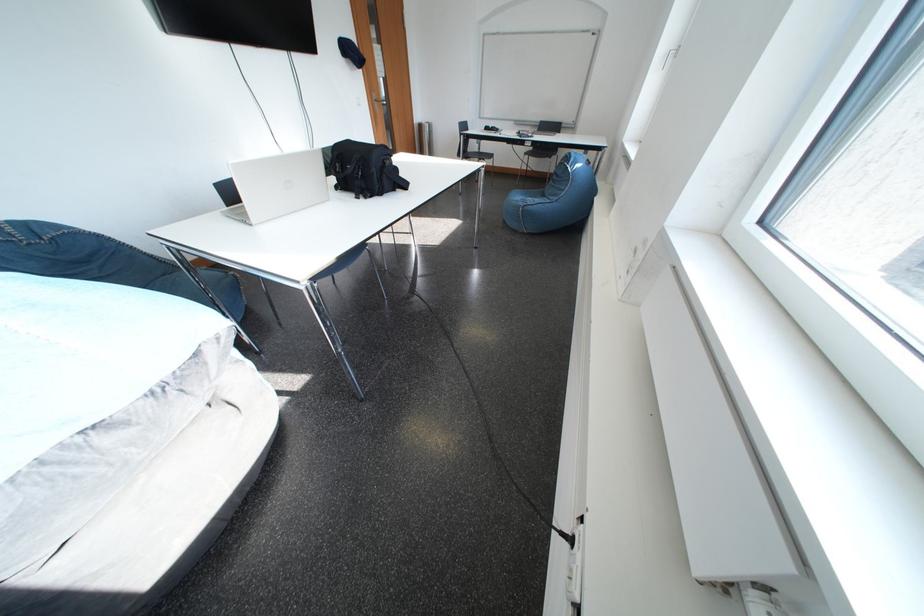
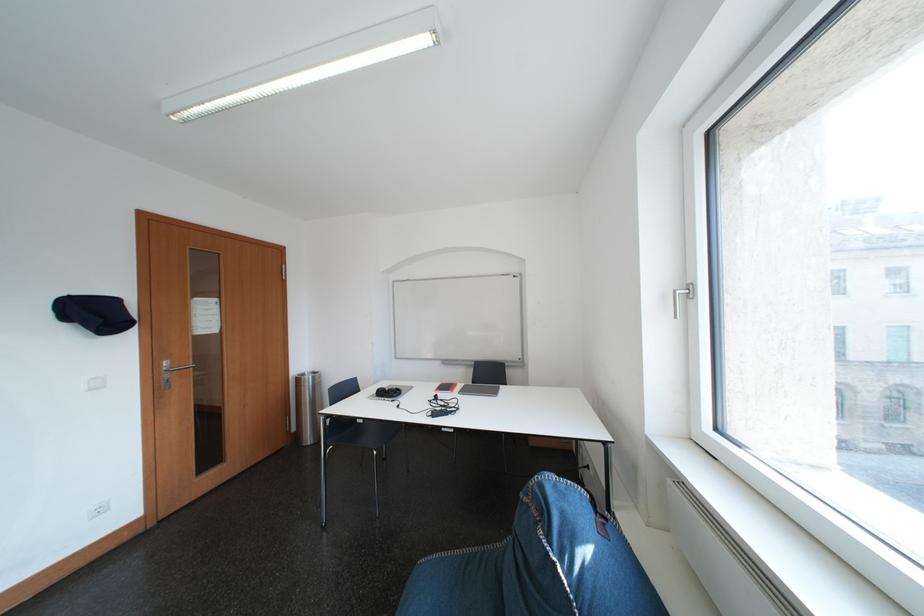
In the second image, find the point that corresponds to [499,132] in the first image.

(393, 395)